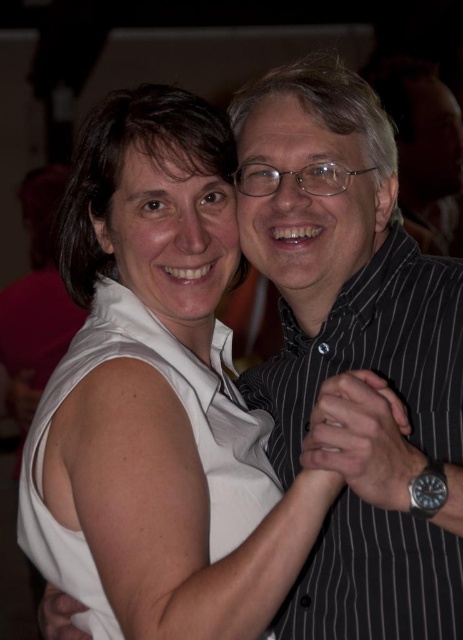
Is black striped dress shirt at right above white sleeveless dress at left?

Correct, black striped dress shirt at right is located above white sleeveless dress at left.

Is black striped dress shirt at right further to the viewer compared to white sleeveless dress at left?

No, black striped dress shirt at right is closer to the viewer.

Measure the distance between point (404, 244) and camera.

A distance of 3.83 feet exists between point (404, 244) and camera.

This screenshot has height=640, width=463. I want to click on black striped dress shirt at right, so click(x=374, y=353).